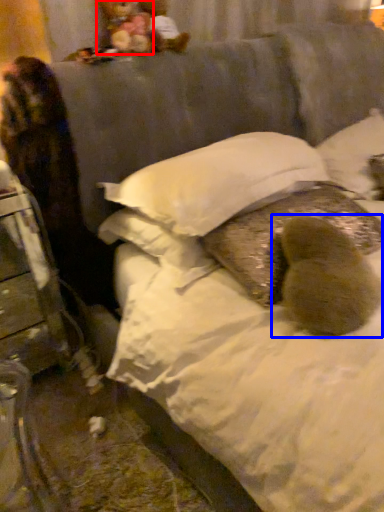
Question: Which object is further to the camera taking this photo, figurine (highlighted by a red box) or animal (highlighted by a blue box)?

Choices:
 (A) figurine
 (B) animal

Answer: (A)